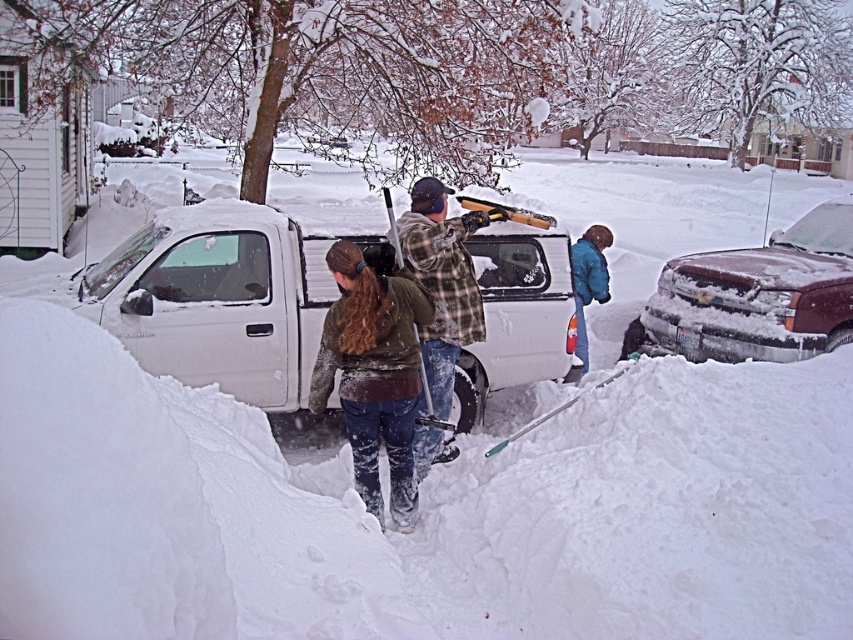
In the scene shown: You are a delivery person trying to find the owner of the white pickup truck. You see two people nearby wearing the green fuzzy sweater at center and the flannel plaid shirt at center. Which one is closer to the truck?

The green fuzzy sweater at center is to the left of flannel plaid shirt at center, so the flannel plaid shirt at center is closer to the truck since they are both at the center but the flannel plaid shirt is to the right of the sweater, which is near the truck.

You are a delivery driver who needs to load a package onto the roof of the white matte truck at center. The package requires a minimum clearance of 1.8 meters. Given the presence of the flannel plaid shirt at center, can you estimate if the truck has sufficient clearance?

The white matte truck at center is shorter than the flannel plaid shirt at center. Since the flannel plaid shirt at center is likely taller than 1.8 meters, the truck may not have sufficient clearance for the package.

You are a photographer trying to capture a closeup of the green fuzzy sweater at center and the flannel plaid shirt at center. Since you want to focus on the textures of the clothing, which one should you zoom in on more to ensure the texture is visible without blurring?

The green fuzzy sweater at center has a lesser width compared to flannel plaid shirt at center, so you should zoom in more on the green fuzzy sweater at center to ensure its texture is visible without blurring.